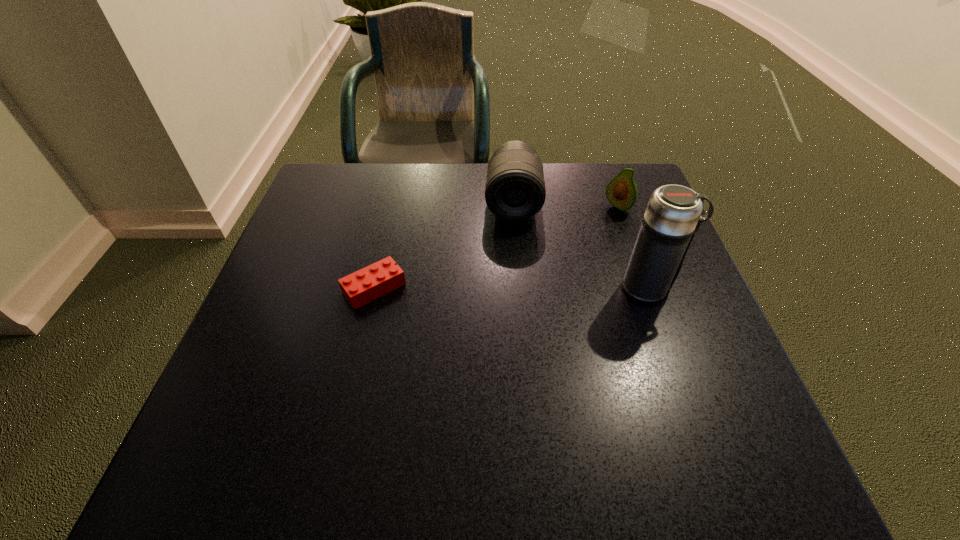
I want to click on free space located 0.120m on the cut side of the third tallest object, so click(x=583, y=235).

Find the location of `free region located on the cut side of the third tallest object`. free region located on the cut side of the third tallest object is located at coordinates (547, 265).

Where is `vacant region located on the cut side of the third tallest object`? vacant region located on the cut side of the third tallest object is located at coordinates pos(524,283).

Identify the location of telephoto lens that is at the far edge. (515, 190).

Where is `avocado located at the far edge`? avocado located at the far edge is located at coordinates (621, 192).

This screenshot has height=540, width=960. I want to click on thermos bottle that is at the right edge, so click(x=673, y=215).

Locate an element on the screen. The image size is (960, 540). avocado that is at the right edge is located at coordinates click(621, 192).

At what (x,y) coordinates should I click in order to perform the action: click on object that is at the far right corner. Please return your answer as a coordinate pair (x, y). Looking at the image, I should click on (621, 192).

Locate an element on the screen. The width and height of the screenshot is (960, 540). vacant space at the far edge of the desktop is located at coordinates (449, 208).

In the image, there is a desktop. At what (x,y) coordinates should I click in order to perform the action: click on vacant region at the near edge. Please return your answer as a coordinate pair (x, y). Looking at the image, I should click on (405, 381).